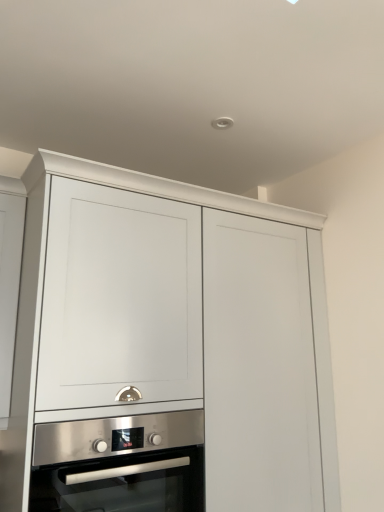
Question: Does stainless steel oven at center have a larger size compared to matte white cabinet at center?

Choices:
 (A) yes
 (B) no

Answer: (B)

Question: From the image's perspective, is stainless steel oven at center on matte white cabinet at center?

Choices:
 (A) yes
 (B) no

Answer: (B)

Question: Does stainless steel oven at center have a smaller size compared to matte white cabinet at center?

Choices:
 (A) no
 (B) yes

Answer: (B)

Question: Is stainless steel oven at center to the left of matte white cabinet at center from the viewer's perspective?

Choices:
 (A) yes
 (B) no

Answer: (A)

Question: From a real-world perspective, is stainless steel oven at center on matte white cabinet at center?

Choices:
 (A) no
 (B) yes

Answer: (A)

Question: Is stainless steel oven at center looking in the opposite direction of matte white cabinet at center?

Choices:
 (A) no
 (B) yes

Answer: (B)

Question: Is matte white cabinet at center wider than stainless steel oven at center?

Choices:
 (A) yes
 (B) no

Answer: (A)

Question: Is matte white cabinet at center thinner than stainless steel oven at center?

Choices:
 (A) yes
 (B) no

Answer: (B)

Question: Can you confirm if matte white cabinet at center is positioned to the left of stainless steel oven at center?

Choices:
 (A) yes
 (B) no

Answer: (B)

Question: Is matte white cabinet at center bigger than stainless steel oven at center?

Choices:
 (A) no
 (B) yes

Answer: (B)

Question: Would you say matte white cabinet at center is a long distance from stainless steel oven at center?

Choices:
 (A) yes
 (B) no

Answer: (B)

Question: From the image's perspective, does matte white cabinet at center appear lower than stainless steel oven at center?

Choices:
 (A) no
 (B) yes

Answer: (A)

Question: From the image's perspective, relative to stainless steel oven at center, is matte white cabinet at center above or below?

Choices:
 (A) below
 (B) above

Answer: (B)